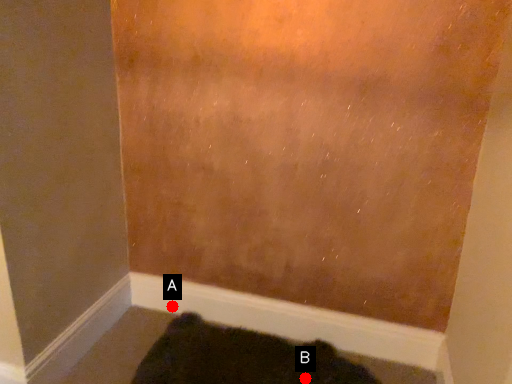
Question: Two points are circled on the image, labeled by A and B beside each circle. Which point is farther to the camera?

Choices:
 (A) A is further
 (B) B is further

Answer: (A)